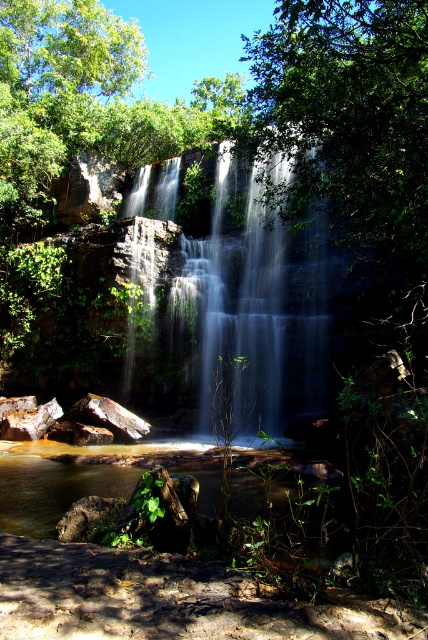
You are standing at the edge of the cliff overlooking the waterfall. You notice two types of water in the scene. Which one is closer to you, the translucent white water at center or the clear water at center?

The translucent white water at center is closer to you because the clear water at center is behind it.

Looking at this image, you are standing at the base of the waterfall and want to reach the point marked as point (244, 188). However, there is an obstacle at point (312, 481) blocking your path. Can you safely walk around the obstacle to reach your destination?

Since point (244, 188) is behind point (312, 481), you can walk around the obstacle at point (312, 481) to reach your destination at point (244, 188) safely.

You are standing at the edge of the cliff overlooking the waterfall. You notice two types of water in the scene. The translucent white water at center and the clear water at center. Which one is closer to you?

The translucent white water at center is located above clear water at center, so it is closer to you.